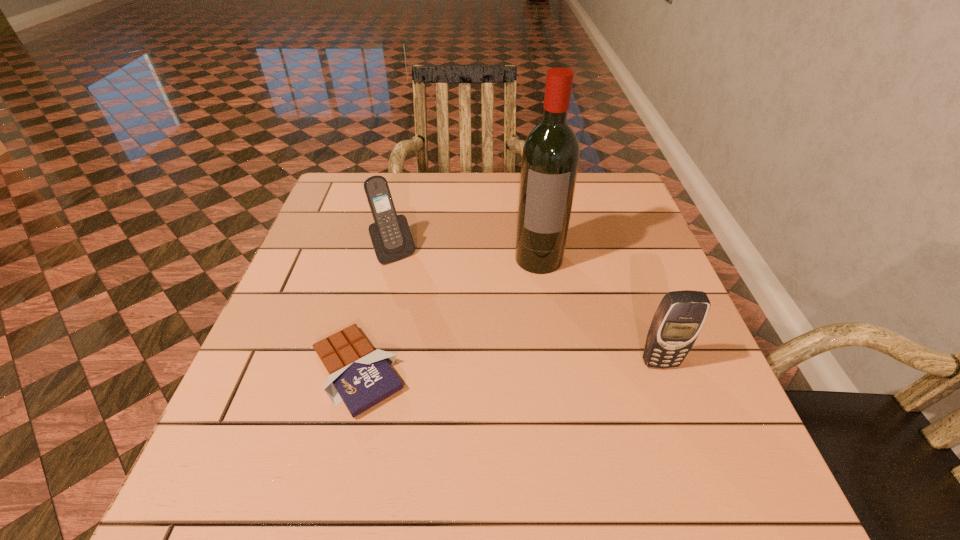
The width and height of the screenshot is (960, 540). In order to click on vacant area located 0.320m on the label of the wine bottle in this screenshot , I will do `click(529, 390)`.

Where is `vacant area situated on the front-facing side of the left cellular telephone`? This screenshot has width=960, height=540. vacant area situated on the front-facing side of the left cellular telephone is located at coordinates (484, 378).

What are the coordinates of `free space located 0.220m on the front-facing side of the left cellular telephone` in the screenshot? It's located at (444, 323).

Image resolution: width=960 pixels, height=540 pixels. I want to click on free region located on the front-facing side of the left cellular telephone, so click(466, 352).

Image resolution: width=960 pixels, height=540 pixels. Identify the location of object that is at the near edge. (361, 377).

Identify the location of object present at the left edge. The width and height of the screenshot is (960, 540). (361, 377).

Image resolution: width=960 pixels, height=540 pixels. Identify the location of object that is at the right edge. (680, 316).

I want to click on object that is at the near left corner, so click(361, 377).

Where is `free region at the far edge of the desktop`? The width and height of the screenshot is (960, 540). free region at the far edge of the desktop is located at coordinates (434, 203).

At what (x,y) coordinates should I click in order to perform the action: click on vacant space at the left edge of the desktop. Please return your answer as a coordinate pair (x, y). The height and width of the screenshot is (540, 960). Looking at the image, I should click on (351, 294).